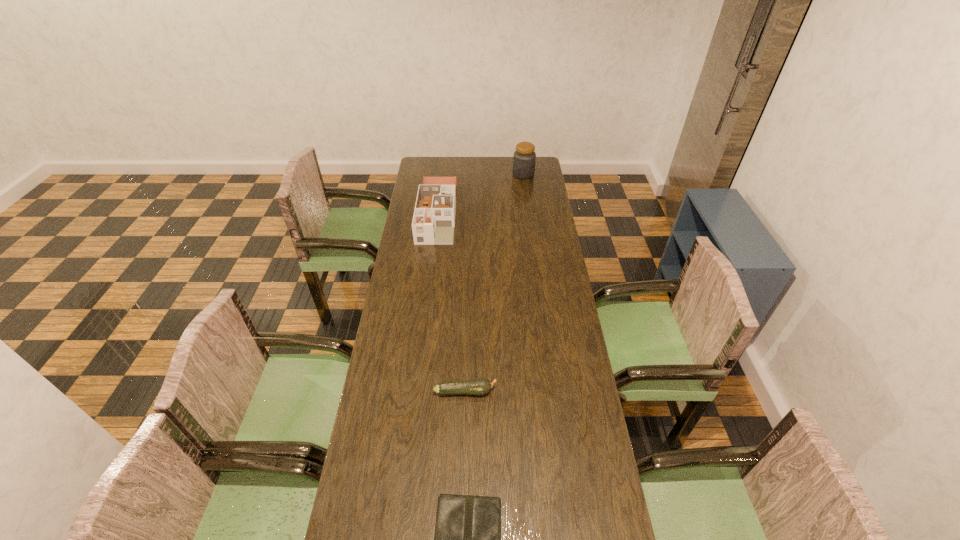
At what (x,y) coordinates should I click in order to perform the action: click on the rightmost object. Please return your answer as a coordinate pair (x, y). Looking at the image, I should click on (524, 158).

I want to click on the farthest object, so click(524, 158).

In order to click on the third shortest object in this screenshot , I will do `click(433, 222)`.

Image resolution: width=960 pixels, height=540 pixels. Identify the location of the third nearest object. (433, 222).

This screenshot has width=960, height=540. In order to click on zucchini in this screenshot , I will do `click(479, 386)`.

Image resolution: width=960 pixels, height=540 pixels. Identify the location of vacant space located on the surface of the jar near the warning symbol. (450, 174).

Identify the location of vacant region located on the surface of the jar near the warning symbol. This screenshot has height=540, width=960. (488, 174).

Locate an element on the screen. The image size is (960, 540). vacant space situated 0.260m on the surface of the jar near the warning symbol is located at coordinates (467, 174).

Identify the location of vacant space located at the front door of the second tallest object. (426, 307).

The height and width of the screenshot is (540, 960). I want to click on vacant space located at the blossom end of the second nearest object, so click(567, 391).